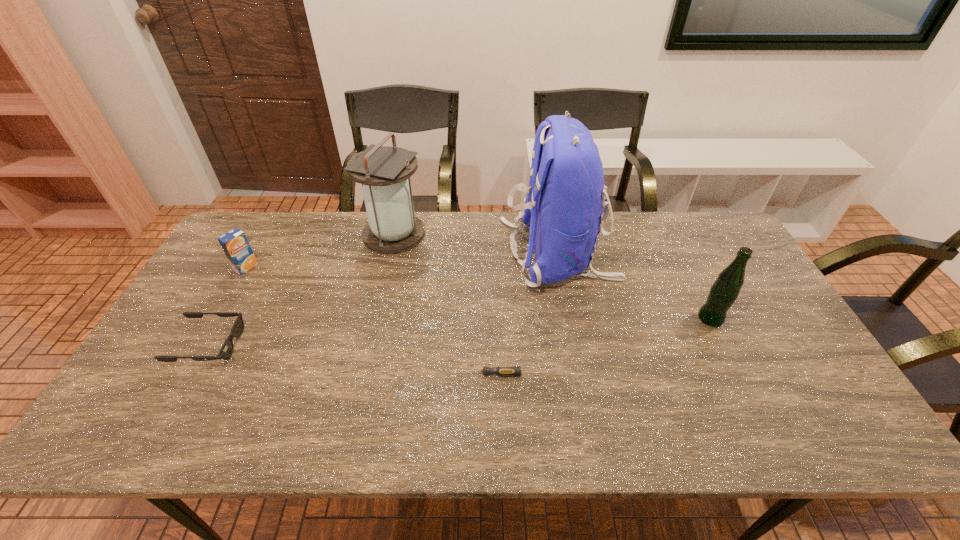
Identify the location of lantern at the far edge. (384, 171).

Where is `orange_juice that is at the left edge`? This screenshot has height=540, width=960. orange_juice that is at the left edge is located at coordinates (234, 243).

The width and height of the screenshot is (960, 540). In order to click on sunglasses situated at the left edge in this screenshot , I will do `click(226, 350)`.

Where is `vacant area at the far edge of the desktop`? This screenshot has width=960, height=540. vacant area at the far edge of the desktop is located at coordinates (491, 238).

In the image, there is a desktop. In order to click on blank space at the near edge in this screenshot , I will do `click(430, 433)`.

At what (x,y) coordinates should I click in order to perform the action: click on vacant space at the left edge of the desktop. Please return your answer as a coordinate pair (x, y). Looking at the image, I should click on (190, 297).

Where is `vacant space at the right edge`? The width and height of the screenshot is (960, 540). vacant space at the right edge is located at coordinates (803, 357).

This screenshot has width=960, height=540. Find the location of `blank space at the far right corner of the desktop`. blank space at the far right corner of the desktop is located at coordinates (693, 244).

Image resolution: width=960 pixels, height=540 pixels. Identify the location of free region at the near right corner of the desktop. (824, 429).

Where is `vacant area that lies between the fourth tallest object and the screwdriver`? This screenshot has height=540, width=960. vacant area that lies between the fourth tallest object and the screwdriver is located at coordinates (366, 320).